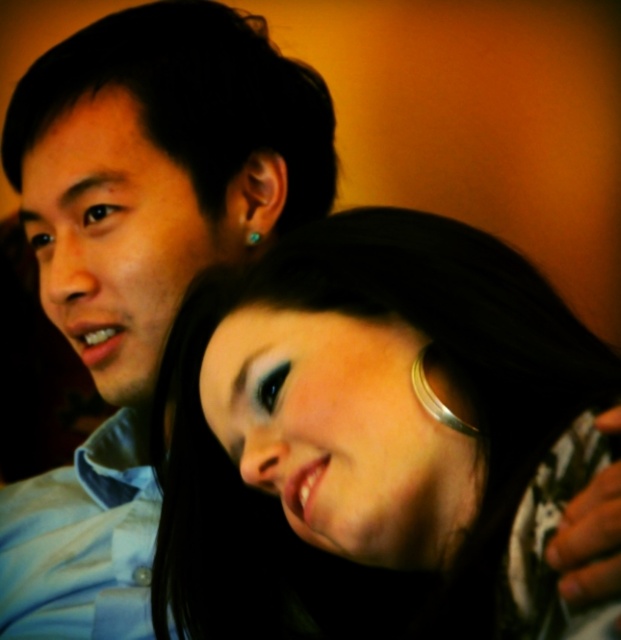
Looking at this image, you are a photographer standing at the center of the scene. You want to capture a close portrait of the smooth silver necklace at center without including the two people. Can you move closer to the necklace to do so?

The smooth silver necklace at center and viewer are 13.00 inches apart. Since you are already at the center, moving closer would require reducing the distance. However, since the necklace is already at the center, you might not need to move closer. Alternatively, adjusting the camera zoom could help focus on the necklace without moving closer. But strictly based on the given distance, you are 13 inches away, so if your camera can focus at that distance, you can capture it without moving. However, the two pe

Where is the smooth silver necklace at center located in the image?

The smooth silver necklace at center is located at point coordinates of 0.684 in the x axis and 0.601 in the y axis.

You are a photographer trying to capture a close portrait of both individuals in the scene. Since the smooth silver necklace at center and the matte blue shirt at left are both important elements, which one should you focus on to ensure both are in sharp focus?

The smooth silver necklace at center is in front of the matte blue shirt at left, so focusing on the smooth silver necklace at center will keep both elements in sharp focus as the background will naturally blur less when focusing on the closer object.